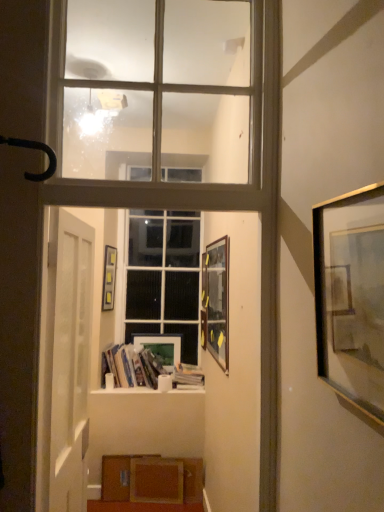
Question: From a real-world perspective, is hardcover books at center, placed as the 2th book when sorted from right to left, below gold metallic picture frame at right, marked as the 1th picture frame in a right-to-left arrangement?

Choices:
 (A) yes
 (B) no

Answer: (A)

Question: From the image's perspective, is hardcover books at center, the first book in the left-to-right sequence, under gold metallic picture frame at right, the 4th picture frame viewed from the left?

Choices:
 (A) no
 (B) yes

Answer: (B)

Question: Does hardcover books at center, the first book in the left-to-right sequence, appear on the right side of gold metallic picture frame at right, marked as the 1th picture frame in a right-to-left arrangement?

Choices:
 (A) no
 (B) yes

Answer: (A)

Question: Are hardcover books at center, the first book in the left-to-right sequence, and gold metallic picture frame at right, the 4th picture frame viewed from the left, far apart?

Choices:
 (A) yes
 (B) no

Answer: (A)

Question: Is gold metallic picture frame at right, the 4th picture frame viewed from the left, located within hardcover books at center, the first book in the left-to-right sequence?

Choices:
 (A) yes
 (B) no

Answer: (B)

Question: In the image, is matte wooden picture frame at center, positioned as the 4th picture frame in front-to-back order, positioned in front of or behind gold metallic picture frame at right, positioned as the 1th picture frame in front-to-back order?

Choices:
 (A) front
 (B) behind

Answer: (B)

Question: From the image's perspective, is matte wooden picture frame at center, positioned as the 4th picture frame in front-to-back order, positioned above or below gold metallic picture frame at right, the 4th picture frame viewed from the left?

Choices:
 (A) below
 (B) above

Answer: (A)

Question: Is matte wooden picture frame at center, the 1th picture frame viewed from the back, bigger or smaller than gold metallic picture frame at right, marked as the 1th picture frame in a right-to-left arrangement?

Choices:
 (A) big
 (B) small

Answer: (B)

Question: In the image, is matte wooden picture frame at center, the second picture frame positioned from the left, on the left side or the right side of gold metallic picture frame at right, marked as the 1th picture frame in a right-to-left arrangement?

Choices:
 (A) right
 (B) left

Answer: (B)

Question: From the image's perspective, relative to hardcover books at center, the first book in the left-to-right sequence, is white matte door at left above or below?

Choices:
 (A) above
 (B) below

Answer: (A)

Question: Is white matte door at left wider or thinner than hardcover books at center, placed as the 2th book when sorted from right to left?

Choices:
 (A) thin
 (B) wide

Answer: (A)

Question: Choose the correct answer: Is white matte door at left inside hardcover books at center, placed as the 2th book when sorted from right to left, or outside it?

Choices:
 (A) inside
 (B) outside

Answer: (B)

Question: In terms of height, does white matte door at left look taller or shorter compared to hardcover books at center, the first book in the left-to-right sequence?

Choices:
 (A) short
 (B) tall

Answer: (B)

Question: Does point (109, 46) appear closer or farther from the camera than point (178, 372)?

Choices:
 (A) farther
 (B) closer

Answer: (B)

Question: Considering the positions of clear glass window at upper center, which appears as the second window when ordered from the bottom, and white paper stack at center, the second book from the left, in the image, is clear glass window at upper center, which appears as the second window when ordered from the bottom, bigger or smaller than white paper stack at center, the second book from the left,?

Choices:
 (A) big
 (B) small

Answer: (A)